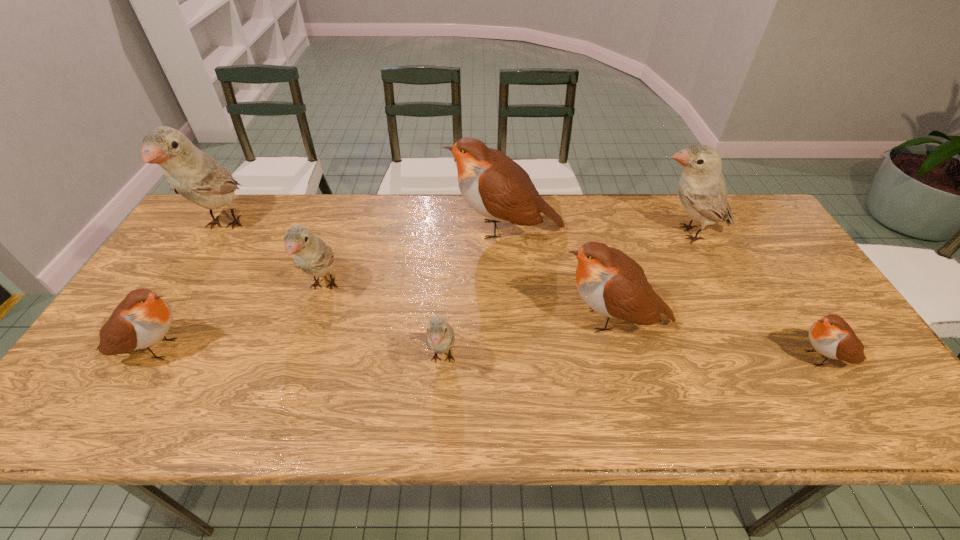
Image resolution: width=960 pixels, height=540 pixels. What are the coordinates of `vacant space situated 0.120m at the face of the third smallest brown bird` in the screenshot? It's located at (508, 320).

Image resolution: width=960 pixels, height=540 pixels. In order to click on vacant space situated at the face of the third smallest brown bird in this screenshot , I will do `click(426, 320)`.

Identify the location of vacant space located 0.300m at the face of the second white bird from left to right. The height and width of the screenshot is (540, 960). (277, 427).

This screenshot has height=540, width=960. I want to click on vacant region located at the face of the leftmost brown bird, so click(x=285, y=349).

This screenshot has width=960, height=540. I want to click on vacant space located 0.070m at the face of the nearest white bird, so click(x=439, y=417).

Identify the location of free region located at the face of the shortest bird. This screenshot has width=960, height=540. (756, 358).

Find the location of a particular element. This screenshot has height=540, width=960. free space located 0.240m at the face of the shortest bird is located at coordinates (684, 358).

You are a GUI agent. You are given a task and a screenshot of the screen. Output one action in this format:
    pyautogui.click(x=<x>, y=<y>)
    Task: Click on the vacant space positioned at the face of the shortest bird
    This screenshot has width=960, height=540.
    Given the screenshot: What is the action you would take?
    pyautogui.click(x=676, y=358)

Where is `object located in the far left corner section of the desktop`? object located in the far left corner section of the desktop is located at coordinates (190, 172).

The width and height of the screenshot is (960, 540). What are the coordinates of `object that is at the far right corner` in the screenshot? It's located at (702, 189).